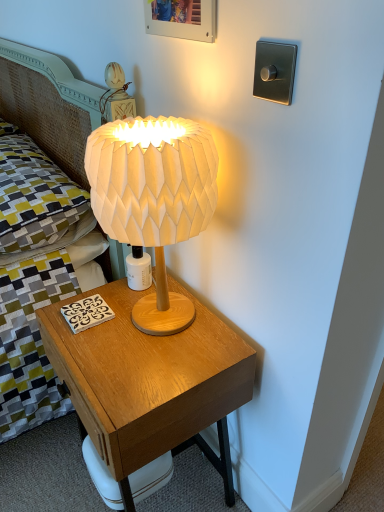
At what (x,y) coordinates should I click in order to perform the action: click on vacant space underneath white paper lampshade at center (from a real-world perspective). Please return your answer as a coordinate pair (x, y). This screenshot has height=512, width=384. Looking at the image, I should click on (168, 316).